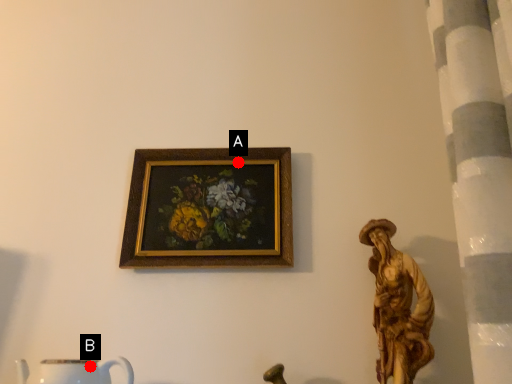
Question: Two points are circled on the image, labeled by A and B beside each circle. Which of the following is the farthest from the observer?

Choices:
 (A) A is further
 (B) B is further

Answer: (A)